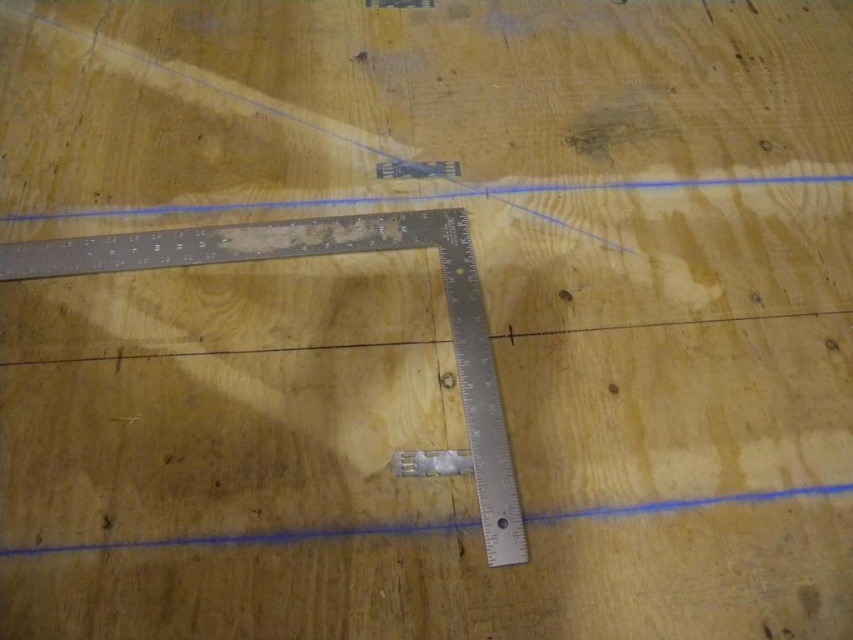
Who is shorter, silver metallic ruler at center or blue line at upper center?

blue line at upper center

Is silver metallic ruler at center positioned at the back of blue line at upper center?

No, silver metallic ruler at center is closer to the viewer.

Find the location of `silver metallic ruler at center`. silver metallic ruler at center is located at coordinates (328, 253).

Which is more to the right, metallic ruler at bottom or blue line at upper center?

blue line at upper center

The image size is (853, 640). I want to click on metallic ruler at bottom, so click(260, 536).

How distant is silver metallic ruler at center from metallic ruler at bottom?

silver metallic ruler at center and metallic ruler at bottom are 13.45 inches apart.

Does silver metallic ruler at center have a lesser height compared to metallic ruler at bottom?

Incorrect, silver metallic ruler at center's height does not fall short of metallic ruler at bottom's.

I want to click on silver metallic ruler at center, so click(x=328, y=253).

The height and width of the screenshot is (640, 853). Find the location of `silver metallic ruler at center`. silver metallic ruler at center is located at coordinates (328, 253).